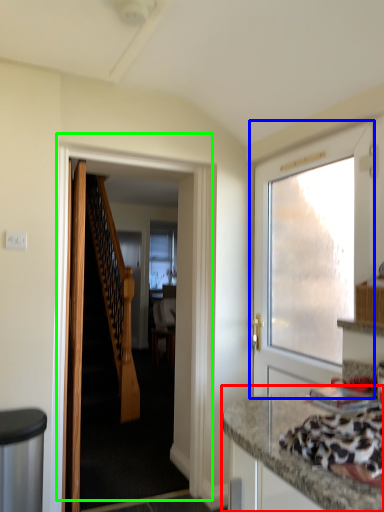
Question: Which object is the farthest from countertop (highlighted by a red box)? Choose among these: door (highlighted by a blue box) or door (highlighted by a green box).

Choices:
 (A) door
 (B) door

Answer: (B)